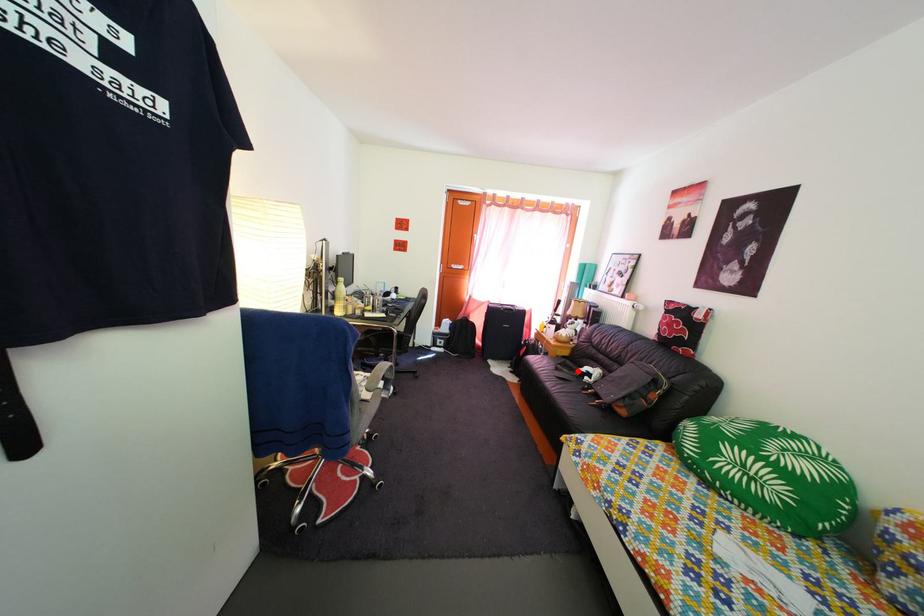
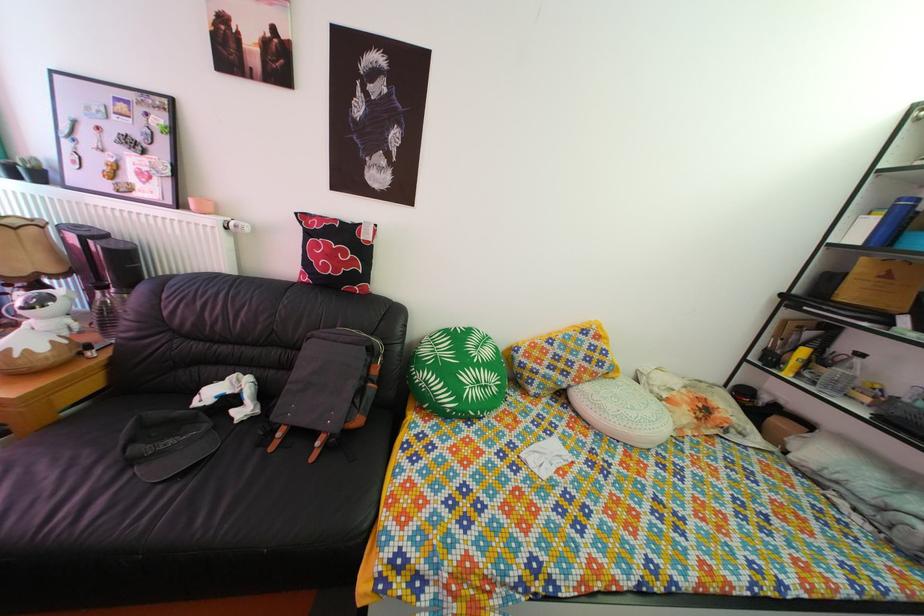
In the second image, find the point that corresponds to the highlighted location in the first image.

(166, 422)